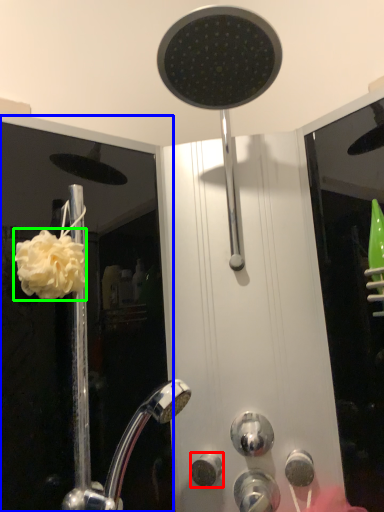
Question: Which object is positioned closest to knob (highlighted by a red box)? Select from screen door (highlighted by a blue box) and flower (highlighted by a green box).

Choices:
 (A) screen door
 (B) flower

Answer: (B)